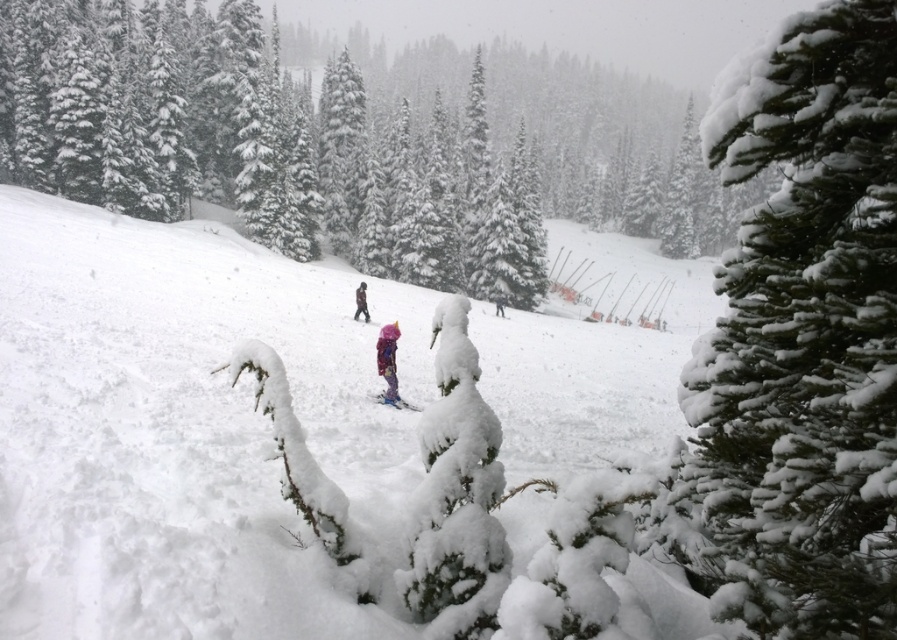
From the picture: Does snow-covered evergreen at center-right have a greater height compared to matte pink ski at center?

Indeed, snow-covered evergreen at center-right has a greater height compared to matte pink ski at center.

Find the location of a particular element. The width and height of the screenshot is (897, 640). snow-covered evergreen at center-right is located at coordinates (800, 340).

Is dark brown snowsuit at center positioned before matte blue ski at center?

No, it is behind matte blue ski at center.

Can you confirm if dark brown snowsuit at center is smaller than matte blue ski at center?

Actually, dark brown snowsuit at center might be larger than matte blue ski at center.

Between point (356, 292) and point (405, 401), which one is positioned behind?

The point (356, 292) is more distant.

Locate an element on the screen. The height and width of the screenshot is (640, 897). dark brown snowsuit at center is located at coordinates (361, 301).

Looking at this image, is matte blue ski at center smaller than matte pink ski at center?

No, matte blue ski at center is not smaller than matte pink ski at center.

Is matte blue ski at center above matte pink ski at center?

No.

What do you see at coordinates (393, 401) in the screenshot? I see `matte blue ski at center` at bounding box center [393, 401].

The width and height of the screenshot is (897, 640). I want to click on matte blue ski at center, so click(x=393, y=401).